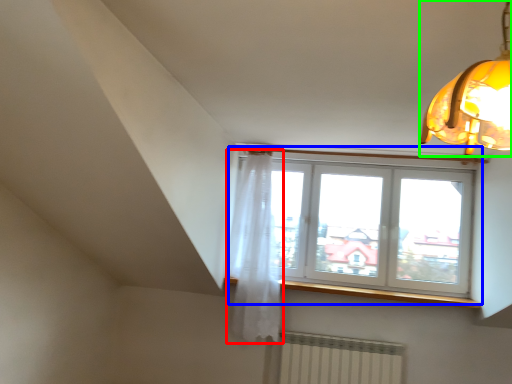
Question: Which object is positioned closest to curtain (highlighted by a red box)? Select from window (highlighted by a blue box) and lamp (highlighted by a green box).

Choices:
 (A) window
 (B) lamp

Answer: (A)